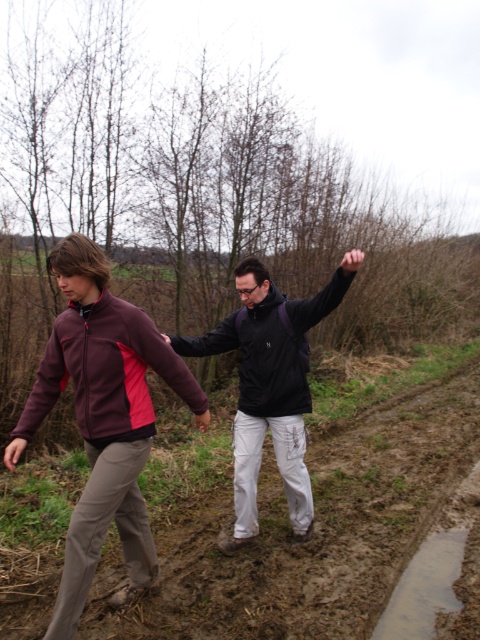
Question: Which object is closer to the camera taking this photo?

Choices:
 (A) matte black jacket at center
 (B) muddy ground at lower center
 (C) maroon fleece jacket at left

Answer: (C)

Question: In this image, where is maroon fleece jacket at left located relative to matte black jacket at center?

Choices:
 (A) below
 (B) above

Answer: (A)

Question: Which is nearer to the muddy ground at lower center?

Choices:
 (A) matte black jacket at center
 (B) maroon fleece jacket at left

Answer: (B)

Question: Does muddy ground at lower center have a lesser width compared to maroon fleece jacket at left?

Choices:
 (A) no
 (B) yes

Answer: (A)

Question: From the image, what is the correct spatial relationship of maroon fleece jacket at left in relation to matte black jacket at center?

Choices:
 (A) below
 (B) above

Answer: (A)

Question: Which point is closer to the camera?

Choices:
 (A) (344, 276)
 (B) (359, 486)

Answer: (A)